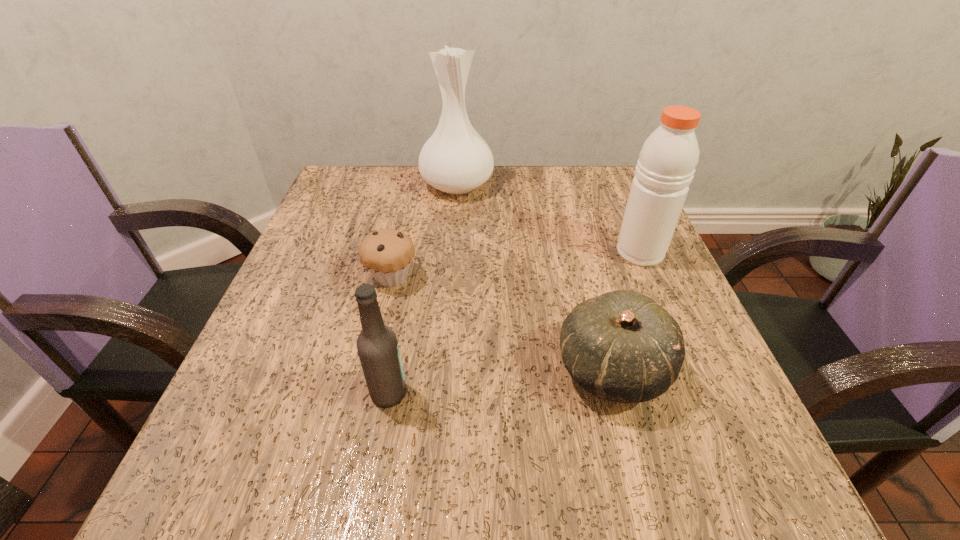
Locate an element on the screen. vase is located at coordinates (455, 160).

You are a GUI agent. You are given a task and a screenshot of the screen. Output one action in this format:
    pyautogui.click(x=<x>, y=<y>)
    Task: Click on the shaker
    
    Given the screenshot: What is the action you would take?
    pyautogui.click(x=666, y=165)

You are a GUI agent. You are given a task and a screenshot of the screen. Output one action in this format:
    pyautogui.click(x=<x>, y=<y>)
    Task: Click on the third tallest object
    The image size is (960, 540).
    Given the screenshot: What is the action you would take?
    pyautogui.click(x=377, y=346)

The width and height of the screenshot is (960, 540). Find the location of `the fourth tallest object`. the fourth tallest object is located at coordinates (622, 346).

Find the location of `muffin`. muffin is located at coordinates (387, 253).

This screenshot has height=540, width=960. I want to click on vacant space located 0.090m on the right of the vase, so click(529, 185).

Image resolution: width=960 pixels, height=540 pixels. Find the location of `free space located on the left of the shaker`. free space located on the left of the shaker is located at coordinates (444, 252).

Where is `free space located 0.320m on the label of the beer bottle`? The height and width of the screenshot is (540, 960). free space located 0.320m on the label of the beer bottle is located at coordinates (622, 393).

The width and height of the screenshot is (960, 540). Identify the location of vacant position located on the left of the second shortest object. (517, 369).

Image resolution: width=960 pixels, height=540 pixels. In order to click on vacant space located 0.150m on the left of the shortest object in this screenshot , I will do `click(287, 277)`.